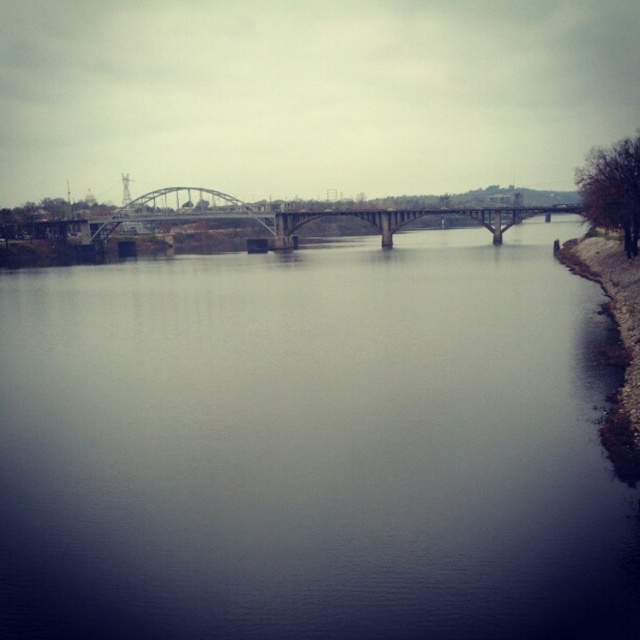
You are a photographer planning to capture the entire length of the metallic gray bridge at center and the gray concrete river at center in a single shot. Based on their sizes, which one will require you to stand further back to include its full length in the photo?

The metallic gray bridge at center is longer than the gray concrete river at center, so you will need to stand further back to capture its full length in the photo.

Based on the photo, you are standing at the point closer to the camera in the image. Which point are you standing at, point (560, 627) or point (145, 198)?

You are standing at point (560, 627) because it is closer to the camera than point (145, 198).

You are a delivery drone with a wingspan of 1.5 meters. You need to fly over the gray concrete river at center to reach the delivery point on the other side. There is a metallic gray bridge at center in your path. Can you safely pass under the bridge without hitting it?

The distance between the gray concrete river at center and the metallic gray bridge at center is 64.86 meters. Since the bridge is 64.86 meters away from the river, the drone can easily pass under it as the height clearance would be sufficient for the 1.5 meter wingspan drone.